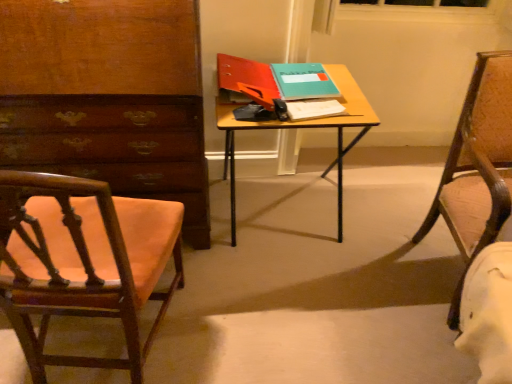
Locate an element on the screen. This screenshot has height=384, width=512. vacant area to the right of wooden desk at center is located at coordinates (375, 239).